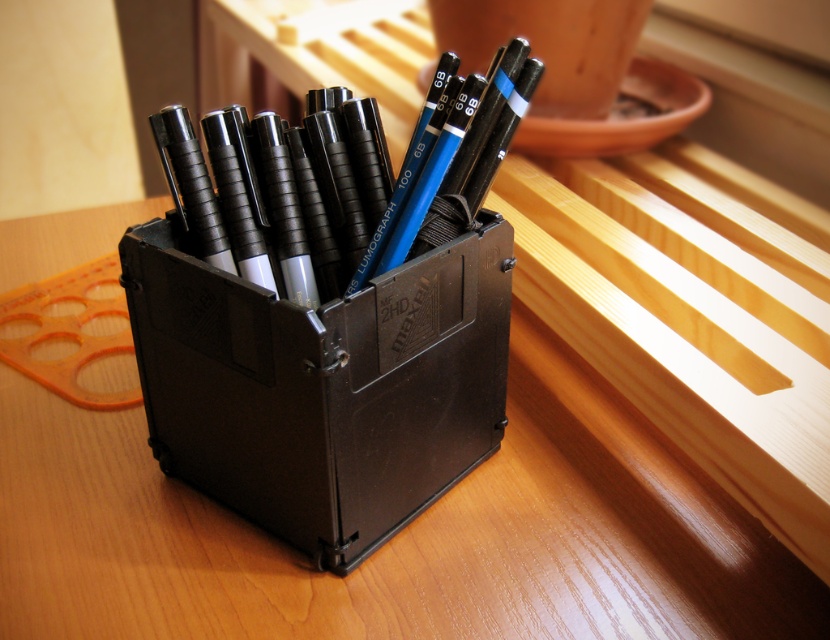
Is wooden table at center shorter than black plastic box at center?

Indeed, wooden table at center has a lesser height compared to black plastic box at center.

Which is above, wooden table at center or black plastic box at center?

Positioned higher is black plastic box at center.

Identify the location of wooden table at center. The image size is (830, 640). (398, 534).

In order to click on wooden table at center in this screenshot , I will do `click(398, 534)`.